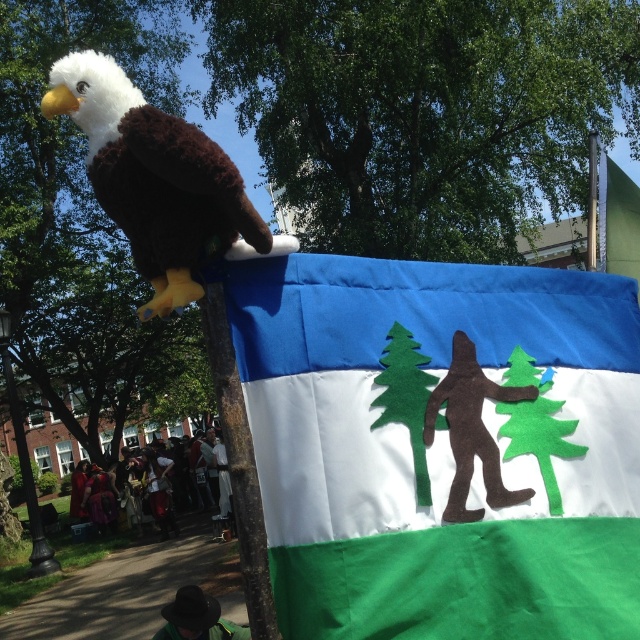
Between point (234, 180) and point (230, 381), which one is positioned in front?

Positioned in front is point (234, 180).

Which is in front, point (52, 70) or point (256, 588)?

Point (52, 70) is more forward.

This screenshot has height=640, width=640. What are the coordinates of `fluffy brown and white eagle at upper left` in the screenshot? It's located at (154, 177).

From the picture: Is blue felt flag at center positioned at the back of fluffy brown and white eagle at upper left?

Yes, blue felt flag at center is behind fluffy brown and white eagle at upper left.

Image resolution: width=640 pixels, height=640 pixels. Describe the element at coordinates (442, 445) in the screenshot. I see `blue felt flag at center` at that location.

Describe the element at coordinates (442, 445) in the screenshot. I see `blue felt flag at center` at that location.

Locate an element on the screen. The height and width of the screenshot is (640, 640). blue felt flag at center is located at coordinates (442, 445).

Is blue felt flag at center bigger than brown wood pole at center?

Correct, blue felt flag at center is larger in size than brown wood pole at center.

Can you confirm if blue felt flag at center is thinner than brown wood pole at center?

No.

Describe the element at coordinates (442, 445) in the screenshot. I see `blue felt flag at center` at that location.

The height and width of the screenshot is (640, 640). In order to click on blue felt flag at center in this screenshot , I will do `click(442, 445)`.